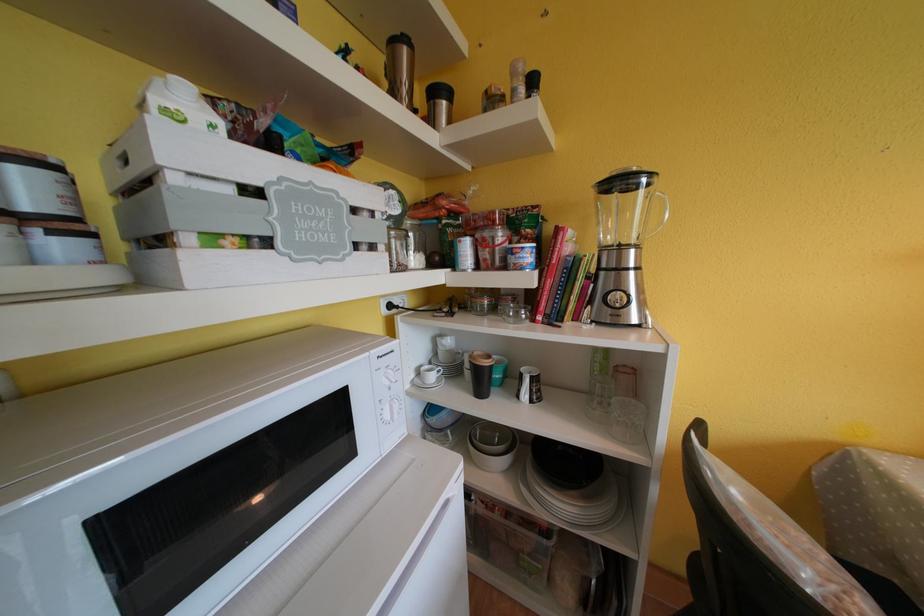
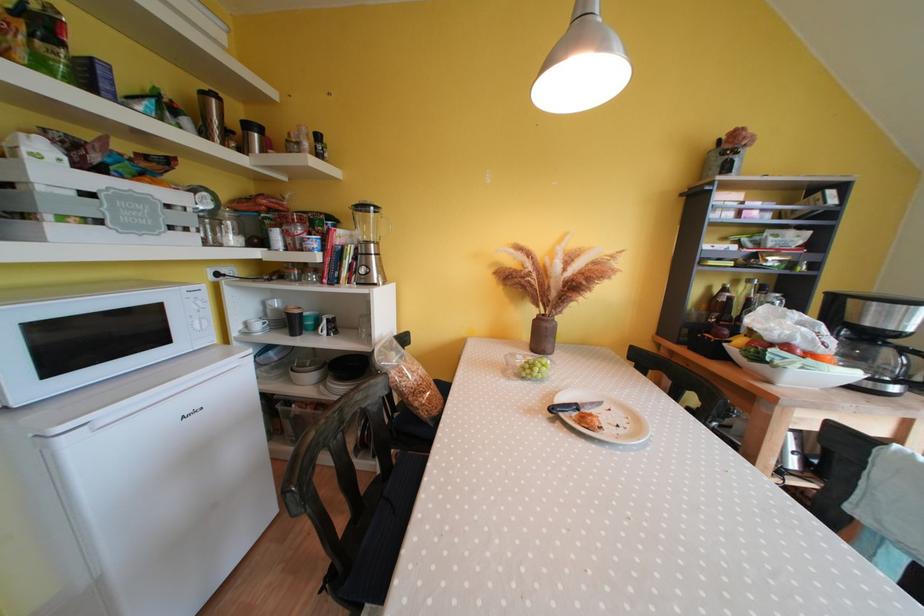
The point at (590,293) is marked in the first image. Where is the corresponding point in the second image?

(357, 269)